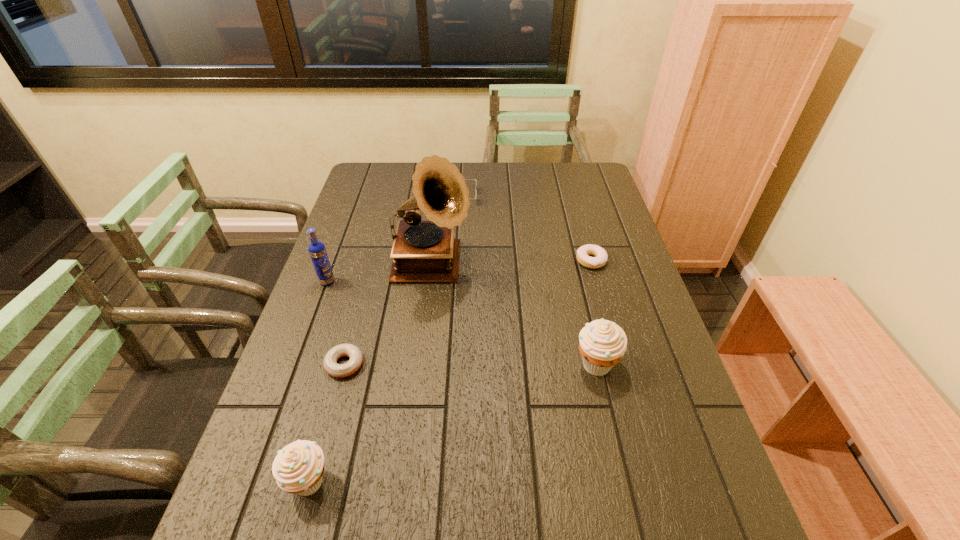
Where is `the left muffin`? The width and height of the screenshot is (960, 540). the left muffin is located at coordinates (298, 468).

Where is `the fourth shortest object`? The width and height of the screenshot is (960, 540). the fourth shortest object is located at coordinates (298, 468).

Locate an element on the screen. the taller muffin is located at coordinates (602, 344).

Find the location of a particular element. the third tallest object is located at coordinates (602, 344).

Locate an element on the screen. The image size is (960, 540). the tallest object is located at coordinates (424, 251).

The width and height of the screenshot is (960, 540). Identify the location of the farthest object. (465, 179).

Identify the location of the leftmost object. (317, 251).

Find the location of a particular element. This screenshot has width=960, height=540. the sixth shortest object is located at coordinates (317, 251).

Locate an element on the screen. The width and height of the screenshot is (960, 540). the left doughnut is located at coordinates (330, 364).

The image size is (960, 540). Find the location of `the farther doughnut`. the farther doughnut is located at coordinates (600, 259).